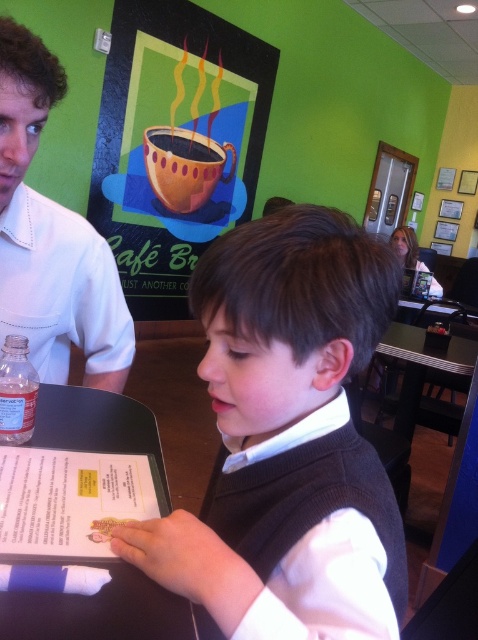
Question: Can you confirm if matte coffee cup at upper center is positioned below black plastic tray at lower left?

Choices:
 (A) yes
 (B) no

Answer: (B)

Question: Does white matte vest at center have a smaller size compared to black plastic tray at lower left?

Choices:
 (A) no
 (B) yes

Answer: (A)

Question: Estimate the real-world distances between objects in this image. Which object is closer to the white paper menu at center?

Choices:
 (A) white shirt at left
 (B) black plastic tray at lower left

Answer: (B)

Question: Considering the relative positions of white matte vest at center and matte coffee cup at upper center in the image provided, where is white matte vest at center located with respect to matte coffee cup at upper center?

Choices:
 (A) below
 (B) above

Answer: (A)

Question: Estimate the real-world distances between objects in this image. Which object is farther from the white paper menu at center?

Choices:
 (A) white shirt at left
 (B) matte coffee cup at upper center
 (C) white matte vest at center
 (D) black plastic tray at lower left

Answer: (B)

Question: Estimate the real-world distances between objects in this image. Which object is farther from the black plastic tray at lower left?

Choices:
 (A) matte coffee cup at upper center
 (B) white paper menu at center

Answer: (A)